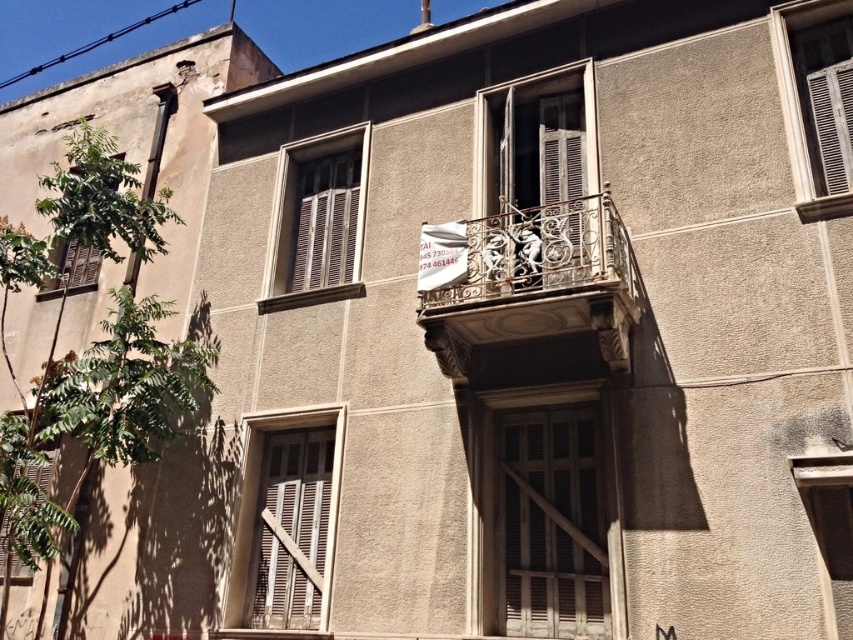
Question: In this image, where is wrought iron balcony at center located relative to white textured window at upper right?

Choices:
 (A) above
 (B) below

Answer: (B)

Question: Does metallic wrought iron balcony at center lie behind white wooden shutter at center?

Choices:
 (A) no
 (B) yes

Answer: (A)

Question: Does metallic wrought iron balcony at center have a greater width compared to matte wood window at upper left?

Choices:
 (A) yes
 (B) no

Answer: (A)

Question: Which of the following is the farthest from the observer?

Choices:
 (A) (556, 147)
 (B) (811, 29)
 (C) (576, 186)
 (D) (326, 445)

Answer: (A)

Question: Which object is the farthest from the green matte window at lower left?

Choices:
 (A) wrought iron balcony at center
 (B) wooden at center

Answer: (A)

Question: Which point is farther from the camera taking this photo?

Choices:
 (A) (74, 268)
 (B) (509, 451)
 (C) (317, 195)

Answer: (A)